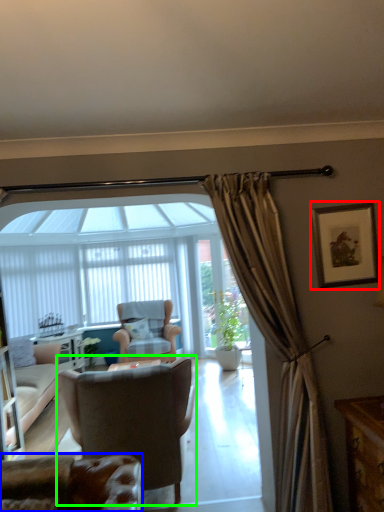
Question: Which object is the farthest from picture frame (highlighted by a red box)? Choose among these: chair (highlighted by a blue box) or chair (highlighted by a green box).

Choices:
 (A) chair
 (B) chair

Answer: (A)